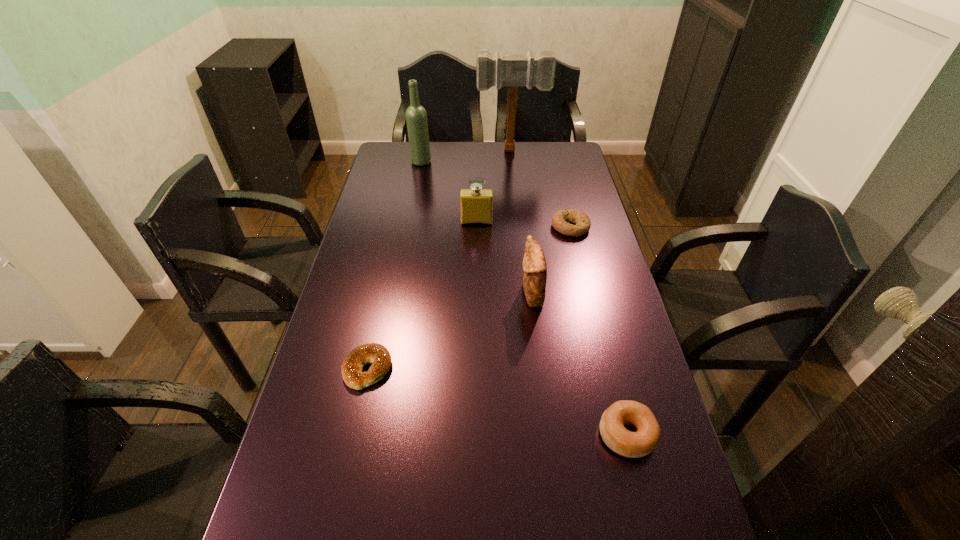
Locate an element on the screen. The height and width of the screenshot is (540, 960). vacant space at the far left corner of the desktop is located at coordinates (388, 159).

Find the location of a particular element. empty space that is in between the third shortest object and the perfume is located at coordinates [x=551, y=328].

The width and height of the screenshot is (960, 540). What are the coordinates of `vacant space that's between the sixth farthest object and the mallet` in the screenshot? It's located at (440, 259).

Identify the location of empty location between the wine bottle and the perfume. (448, 192).

You are a GUI agent. You are given a task and a screenshot of the screen. Output one action in this format:
    pyautogui.click(x=<x>, y=<y>)
    Task: Click on the vacant area between the nearest object and the farthest bagel
    This screenshot has width=960, height=540.
    Given the screenshot: What is the action you would take?
    pyautogui.click(x=598, y=330)

At what (x,y) coordinates should I click in order to perform the action: click on free point between the sixth shortest object and the perfume. Please return your answer as a coordinate pair (x, y). Image resolution: width=960 pixels, height=540 pixels. Looking at the image, I should click on (448, 192).

Where is `vacant region between the perfume and the third shortest object`? The image size is (960, 540). vacant region between the perfume and the third shortest object is located at coordinates click(551, 328).

Image resolution: width=960 pixels, height=540 pixels. Find the location of `object that is the sixth closest one to the second farthest bagel`. object that is the sixth closest one to the second farthest bagel is located at coordinates (512, 70).

Choose which object is the sixth nearest neighbor to the farthest object. Please provide its 2D coordinates. Your answer should be formatted as a tuple, i.e. [(x, y)], where the tuple contains the x and y coordinates of a point satisfying the conditions above.

[(642, 442)]

In order to click on the closest bagel to the sixth farthest object in this screenshot , I will do `click(642, 442)`.